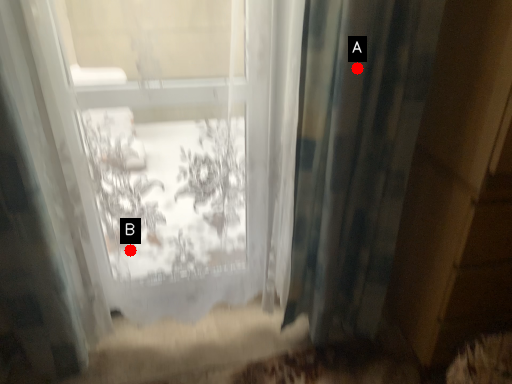
Question: Two points are circled on the image, labeled by A and B beside each circle. Which of the following is the farthest from the observer?

Choices:
 (A) A is further
 (B) B is further

Answer: (B)